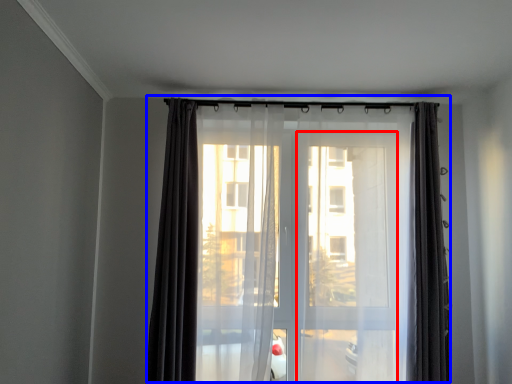
Question: Among these objects, which one is nearest to the camera, screen door (highlighted by a red box) or curtain (highlighted by a blue box)?

Choices:
 (A) screen door
 (B) curtain

Answer: (A)